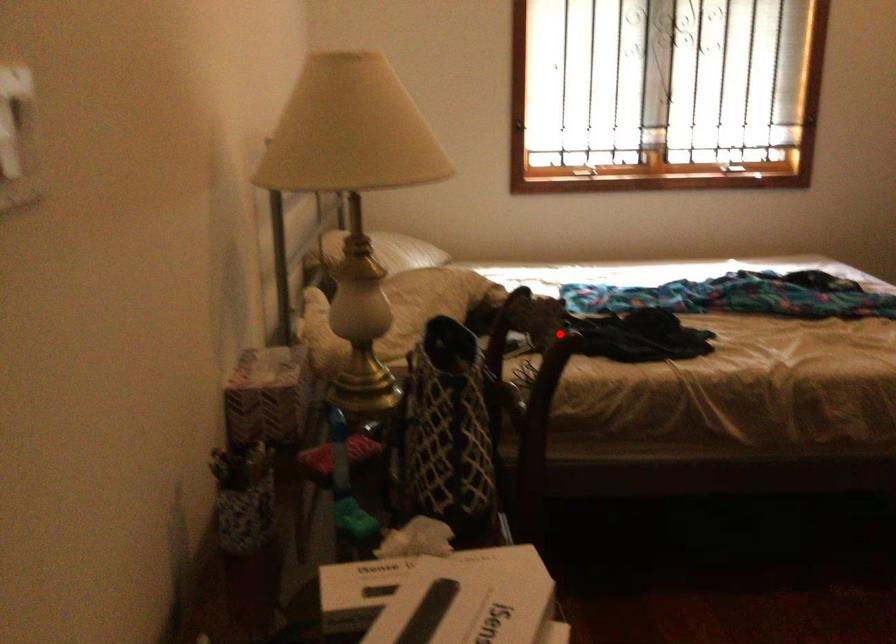
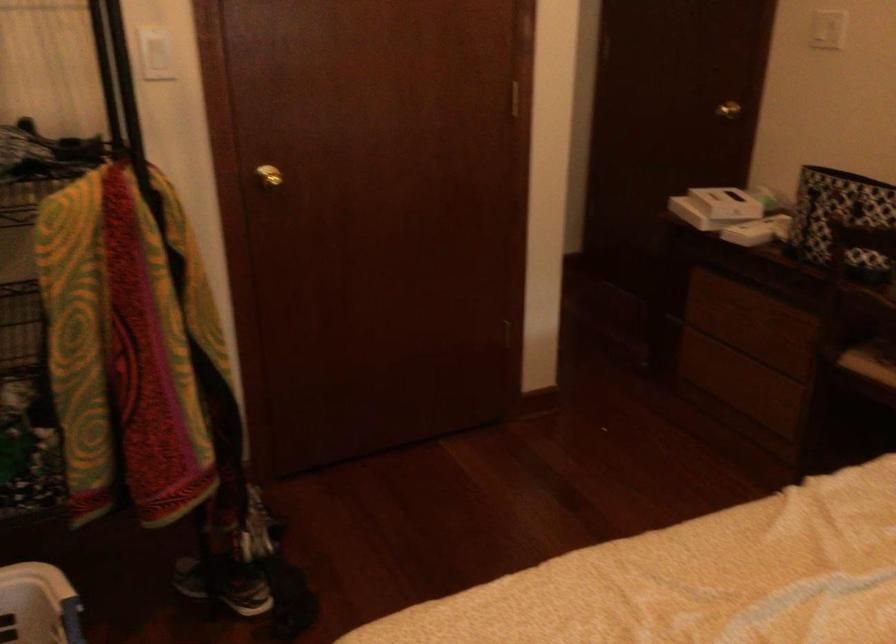
The point at the highlighted location is marked in the first image. Where is the corresponding point in the second image?

(840, 218)